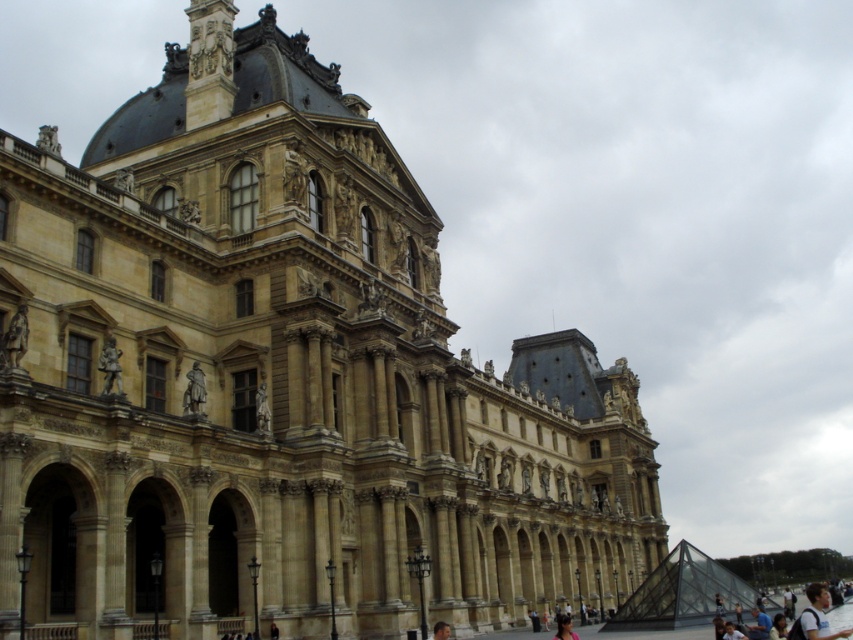
Which is in front, point (198, 371) or point (436, 637)?

Point (436, 637) is in front.

Is point (202, 394) positioned before point (440, 637)?

That is False.

This screenshot has width=853, height=640. In order to click on bronze statue at center in this screenshot , I will do tap(194, 392).

Who is taller, light brown hair at lower right or dark brown hair at lower center?

light brown hair at lower right is taller.

Between point (820, 632) and point (434, 625), which one is positioned behind?

Positioned behind is point (434, 625).

Does point (811, 634) come in front of point (445, 627)?

Yes, it is.

Where is `light brown hair at lower right`? This screenshot has width=853, height=640. light brown hair at lower right is located at coordinates (817, 616).

Is light brown hair at lower right smaller than bronze statue at center?

Actually, light brown hair at lower right might be larger than bronze statue at center.

From the picture: Is light brown hair at lower right above bronze statue at center?

Incorrect, light brown hair at lower right is not positioned above bronze statue at center.

Who is more forward, (821, 611) or (184, 394)?

Point (821, 611) is in front.

At what (x,y) coordinates should I click in order to perform the action: click on light brown hair at lower right. Please return your answer as a coordinate pair (x, y). The width and height of the screenshot is (853, 640). Looking at the image, I should click on (817, 616).